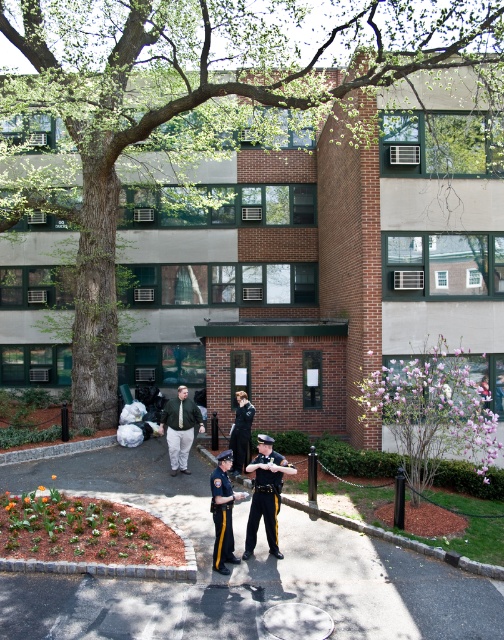
Question: Which object is closer to the camera taking this photo?

Choices:
 (A) black matte uniform at center
 (B) shiny black uniform at center
 (C) dark blue uniform at center
 (D) smooth asphalt pavement at center

Answer: (C)

Question: Does black matte uniform at center have a greater width compared to dark blue uniform at center?

Choices:
 (A) no
 (B) yes

Answer: (B)

Question: Where is green matte jacket at center located in relation to dark blue uniform at center in the image?

Choices:
 (A) above
 (B) below

Answer: (A)

Question: Which of these objects is positioned farthest from the smooth asphalt pavement at center?

Choices:
 (A) dark blue uniform at center
 (B) green matte jacket at center
 (C) black matte uniform at center

Answer: (B)

Question: Considering the relative positions of black matte uniform at center and dark blue uniform at center in the image provided, where is black matte uniform at center located with respect to dark blue uniform at center?

Choices:
 (A) below
 (B) above

Answer: (B)

Question: Which point appears farthest from the camera in this image?

Choices:
 (A) (248, 552)
 (B) (181, 390)
 (C) (245, 458)
 (D) (391, 556)

Answer: (B)